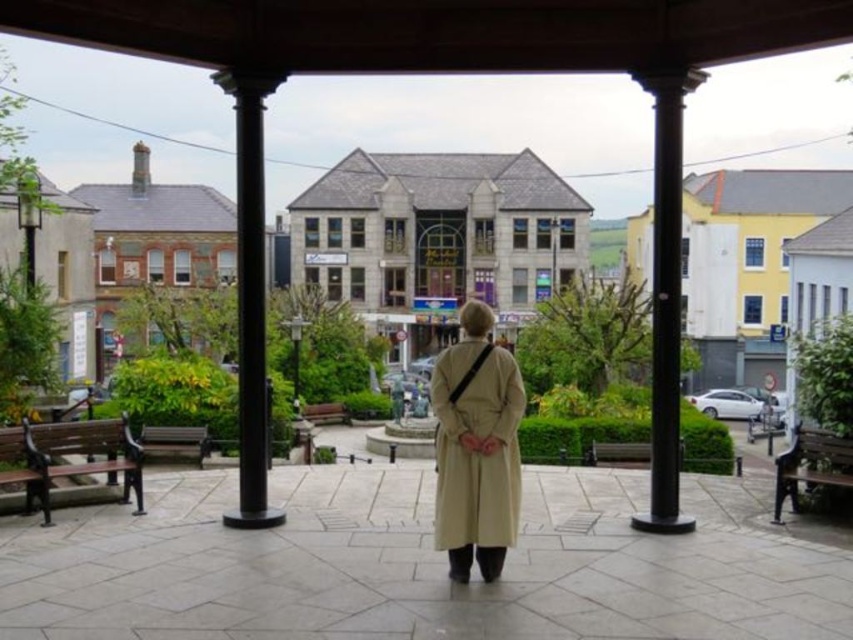
Question: Which of these objects is positioned farthest from the wooden bench at left?

Choices:
 (A) black polished column at left
 (B) black polished column at right
 (C) wooden bench at center

Answer: (B)

Question: Does black polished column at right have a lesser width compared to wooden bench at right?

Choices:
 (A) no
 (B) yes

Answer: (A)

Question: Which object appears farthest from the camera in this image?

Choices:
 (A) black polished column at left
 (B) wooden bench at center

Answer: (B)

Question: Does wooden bench at center have a lesser width compared to brown wooden bench at center?

Choices:
 (A) yes
 (B) no

Answer: (B)

Question: Is black polished column at right wider than wooden bench at right?

Choices:
 (A) yes
 (B) no

Answer: (A)

Question: Among these points, which one is farthest from the camera?

Choices:
 (A) (138, 468)
 (B) (447, 500)
 (C) (717, 467)

Answer: (C)